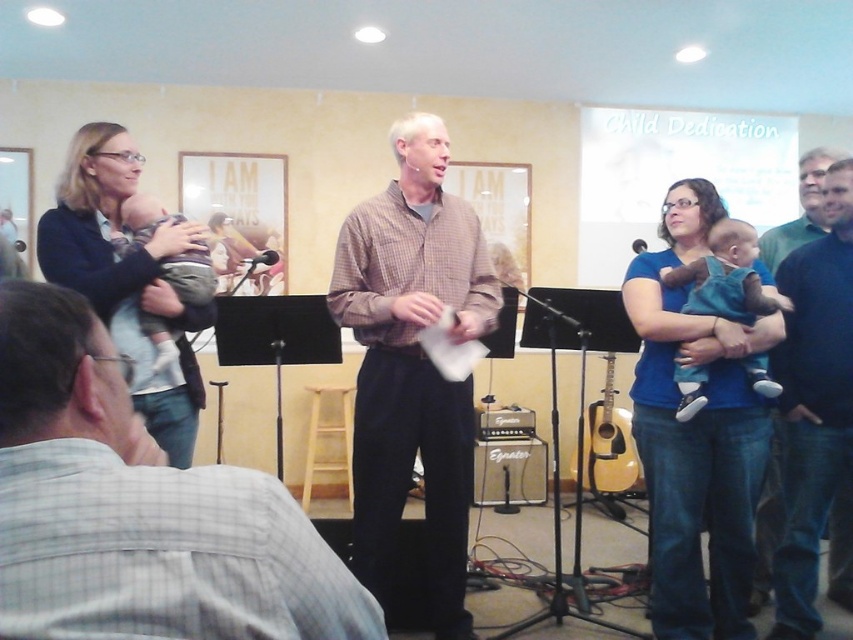
What is located at the point with coordinates (813, 403)?

The dark blue sweater at right is located at the point with coordinates (813, 403).

You are a photographer positioned at the back of the room. You want to take a photo that includes both the acoustic guitar at center and the black plastic microphone at center. Which object should you adjust your camera angle to focus on first to ensure both are in frame?

The acoustic guitar at center is to the right of the black plastic microphone at center. To include both in the frame, focus on the black plastic microphone at center first since it is on the left, then adjust the camera to include the acoustic guitar at center to the right.

You are attending a ceremony and need to choose between the black plastic microphone at center and the metallic silver microphone at center. Which one is positioned to the left?

The black plastic microphone at center is positioned to the left of the metallic silver microphone at center.